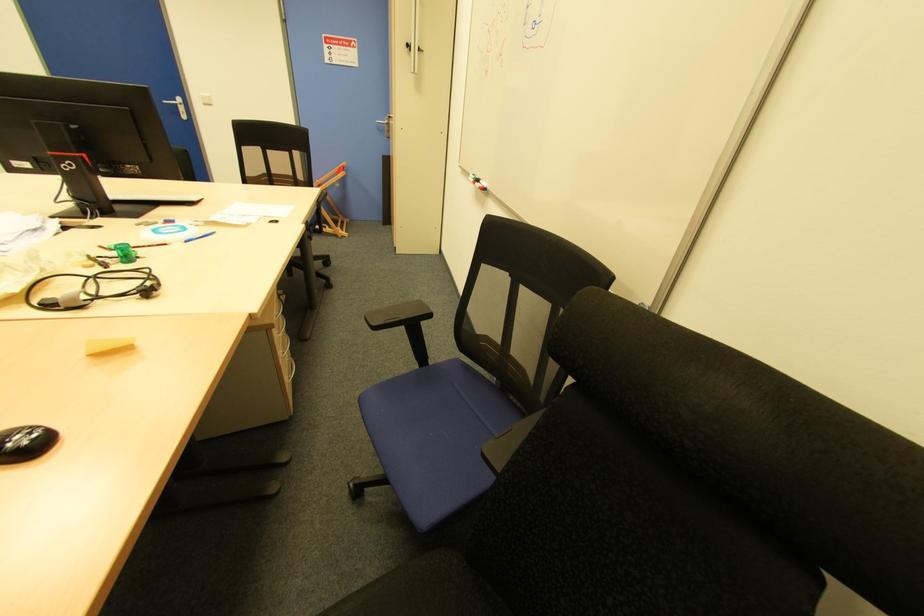
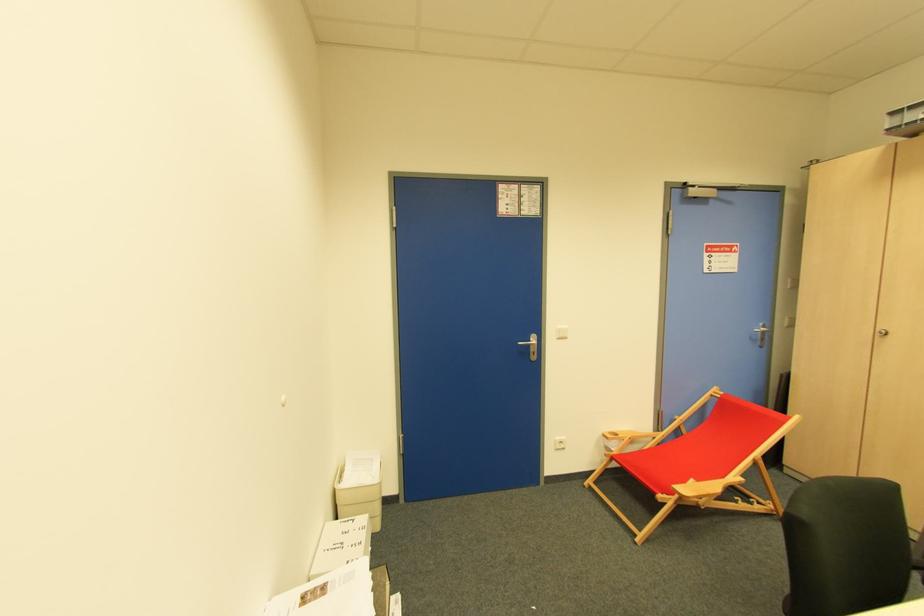
In the second image, find the point that corresponds to pixel 387 126 in the first image.

(763, 333)